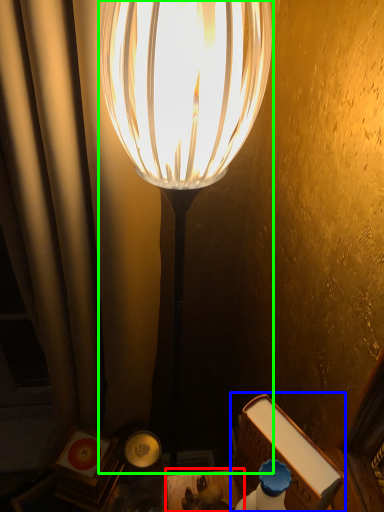
Question: Which object is positioned farthest from table (highlighted by a red box)? Select from book (highlighted by a blue box) and lamp (highlighted by a green box).

Choices:
 (A) book
 (B) lamp

Answer: (B)